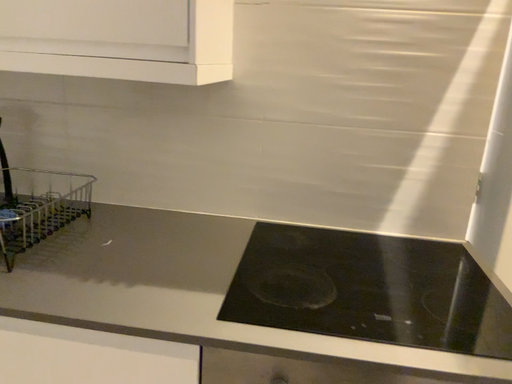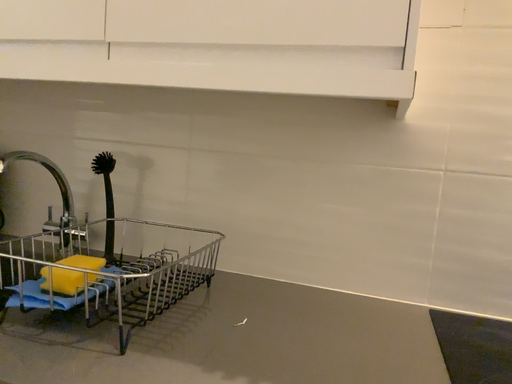
Question: Which way did the camera rotate in the video?

Choices:
 (A) rotated downward
 (B) rotated upward

Answer: (B)